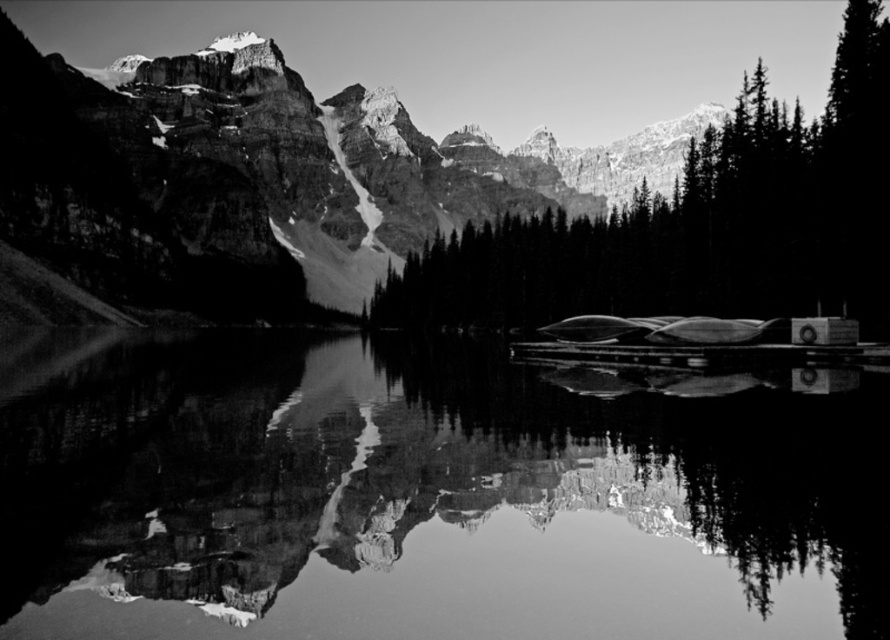
You are standing at the edge of the lake in the image. Which object, the smooth water at center or the smooth dark green trees at center, would appear larger to you?

The smooth water at center appears larger because it is closer to the viewer than the smooth dark green trees at center.

You are a hiker standing on the edge of the smooth water at center. You want to walk to the smooth dark green trees at center. Given that your average walking speed is 1.5 meters per second, how many seconds will it take you to reach the trees?

The distance between the smooth water at center and the smooth dark green trees at center is 101.88 meters. At a walking speed of 1.5 meters per second, dividing the distance by the speed gives 101.88 divided by 1.5, which equals approximately 67.92 seconds. Therefore, it will take roughly 68 seconds to reach the trees.